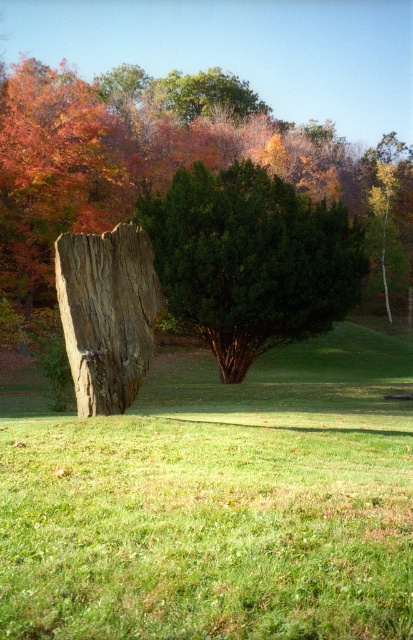
Question: Among these objects, which one is farthest from the camera?

Choices:
 (A) green leafy tree at upper center
 (B) green matte tree at center
 (C) green grass at center

Answer: (A)

Question: Which of these objects is positioned closest to the green matte tree at center?

Choices:
 (A) wooden stump at center
 (B) green leafy tree at upper center

Answer: (A)

Question: Based on their relative distances, which object is nearer to the green leafy tree at upper center?

Choices:
 (A) green grass at center
 (B) wooden stump at center
 (C) green matte tree at center

Answer: (C)

Question: Is green matte tree at center in front of green leafy tree at upper center?

Choices:
 (A) yes
 (B) no

Answer: (A)

Question: Considering the relative positions of green grass at center and green leafy tree at upper center in the image provided, where is green grass at center located with respect to green leafy tree at upper center?

Choices:
 (A) above
 (B) below

Answer: (B)

Question: Observing the image, what is the correct spatial positioning of green matte tree at center in reference to green leafy tree at upper center?

Choices:
 (A) above
 (B) below

Answer: (B)